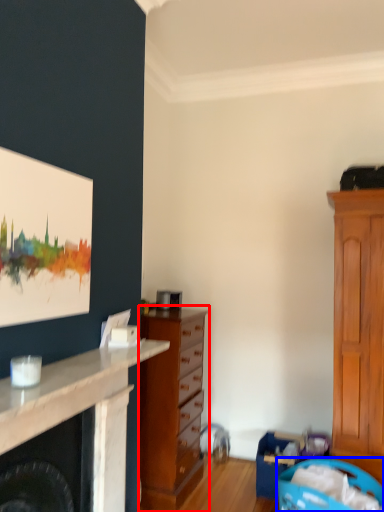
Question: Which object is further to the camera taking this photo, chest of drawers (highlighted by a red box) or laundry basket (highlighted by a blue box)?

Choices:
 (A) chest of drawers
 (B) laundry basket

Answer: (A)